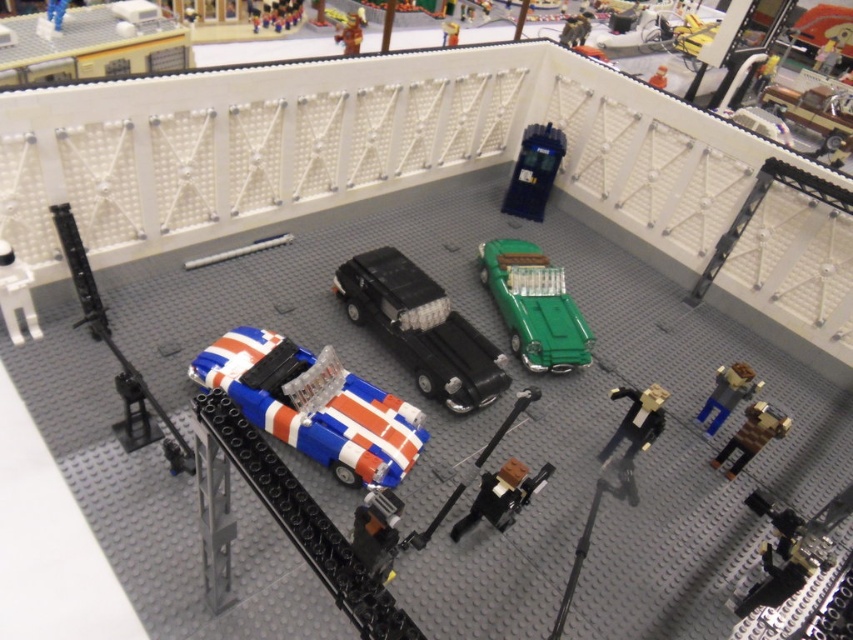
Which of these two, brick-patterned plastic train car at lower left or black plastic figure at lower right, stands shorter?

black plastic figure at lower right

How much distance is there between brick-patterned plastic train car at lower left and black plastic figure at lower right?

A distance of 70.13 centimeters exists between brick-patterned plastic train car at lower left and black plastic figure at lower right.

The width and height of the screenshot is (853, 640). Identify the location of brick-patterned plastic train car at lower left. (314, 404).

Who is lower down, metallic blue police box at upper right or brown matte figure at lower right?

Positioned lower is brown matte figure at lower right.

Between metallic blue police box at upper right and brown matte figure at lower right, which one has more height?

metallic blue police box at upper right is taller.

Is point (537, 212) more distant than point (746, 458)?

Yes.

Locate an element on the screen. The image size is (853, 640). metallic blue police box at upper right is located at coordinates (534, 172).

Which is below, brick-patterned plastic train car at lower left or black plastic car at center?

Positioned lower is brick-patterned plastic train car at lower left.

Between brick-patterned plastic train car at lower left and black plastic car at center, which one appears on the right side from the viewer's perspective?

black plastic car at center

Is point (300, 442) farther from viewer compared to point (383, 256)?

No, (300, 442) is closer to viewer.

Identify the location of brick-patterned plastic train car at lower left. The height and width of the screenshot is (640, 853). (314, 404).